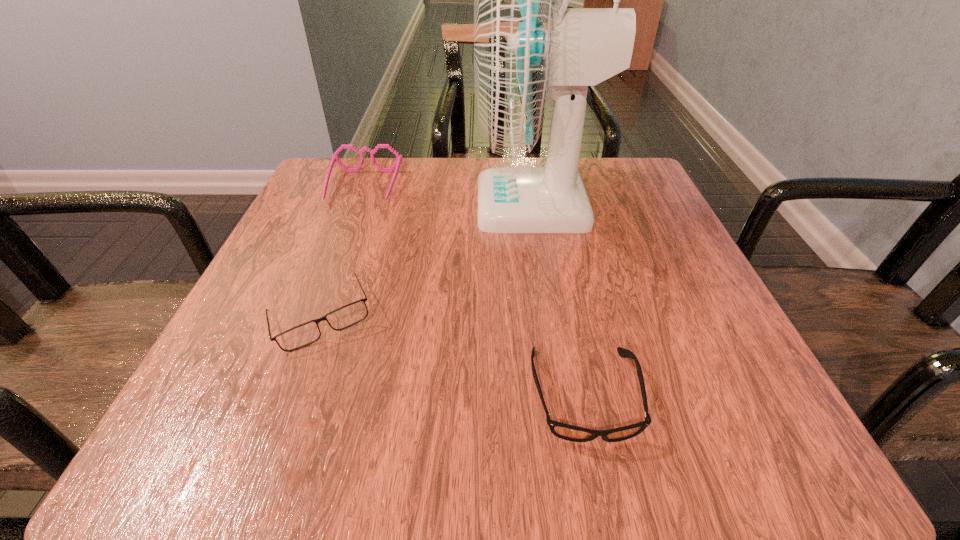
Locate an element on the screen. The width and height of the screenshot is (960, 540). spectacles that is at the far edge is located at coordinates (334, 157).

In order to click on object that is at the near edge in this screenshot , I will do point(564,431).

At what (x,y) coordinates should I click in order to perform the action: click on object at the right edge. Please return your answer as a coordinate pair (x, y). This screenshot has height=540, width=960. Looking at the image, I should click on (529, 47).

In order to click on object present at the far left corner in this screenshot , I will do `click(334, 157)`.

Locate an element on the screen. The height and width of the screenshot is (540, 960). object that is positioned at the far right corner is located at coordinates (529, 47).

This screenshot has height=540, width=960. Find the location of `vacant space at the far edge of the desktop`. vacant space at the far edge of the desktop is located at coordinates (416, 174).

Image resolution: width=960 pixels, height=540 pixels. Find the location of `free space at the near edge of the desktop`. free space at the near edge of the desktop is located at coordinates (583, 424).

Locate an element on the screen. vacant space at the left edge of the desktop is located at coordinates 344,220.

Where is `vacant space at the right edge of the desktop`? This screenshot has width=960, height=540. vacant space at the right edge of the desktop is located at coordinates (677, 330).

Locate an element on the screen. The image size is (960, 540). free space at the far left corner is located at coordinates (322, 185).